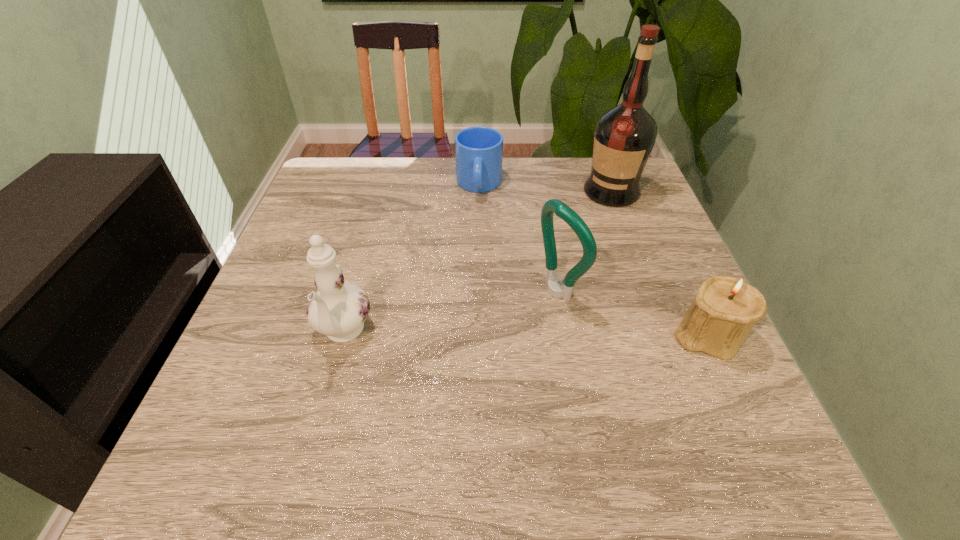
At what (x,y) coordinates should I click in order to perform the action: click on free spot on the desktop that is between the chinaware and the candle_holder and is positioned on the surface of the tallest object. Please return your answer as a coordinate pair (x, y). Looking at the image, I should click on (517, 334).

Find the location of `vacant space on the desktop that is between the leftmost object and the fourth tallest object and is positioned on the side of the mug with the handle`. vacant space on the desktop that is between the leftmost object and the fourth tallest object and is positioned on the side of the mug with the handle is located at coordinates (475, 334).

This screenshot has height=540, width=960. Identify the location of vacant spot on the desktop that is between the leftmost object and the candle_holder and is positioned at the jaws of the third object from right to left. (470, 334).